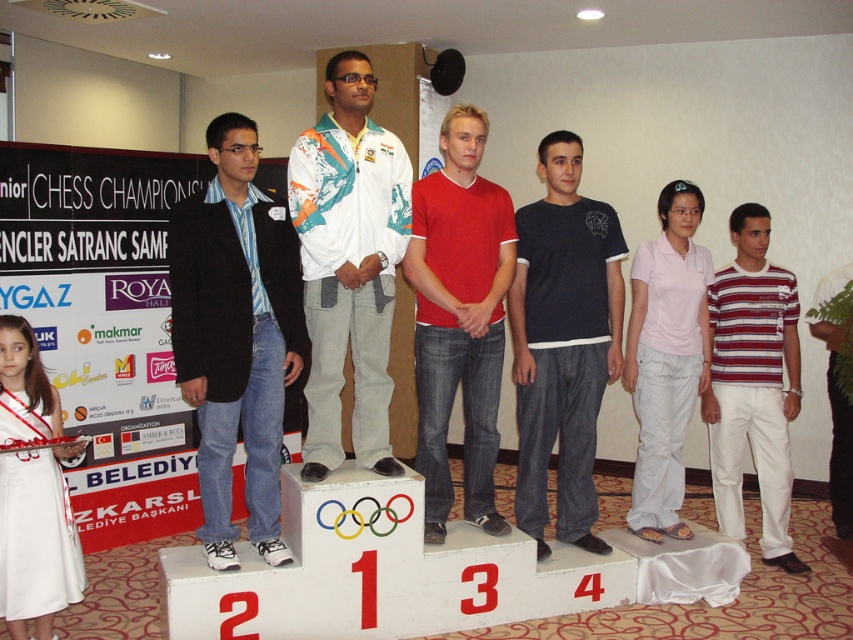
You are a photographer standing at the edge of the podium. You need to take a photo of the white fabric jacket at center without any obstructions. The camera you are using has a minimum focusing distance of 2 meters. Can you take the photo from your current position?

The white fabric jacket at center and camera are 3.05 meters apart. Since the minimum focusing distance is 2 meters, the photographer can take the photo from the current position because the distance is sufficient.

You are standing at the origin of a coordinate system placed at the bottom left corner of the podium. A white fabric jacket at center is located at point (x=347, y=262). If you want to walk directly to the white fabric jacket at center, in which direction should you move first?

You should move towards the northeast direction first to reach the white fabric jacket at center located at point (x=347, y=262).